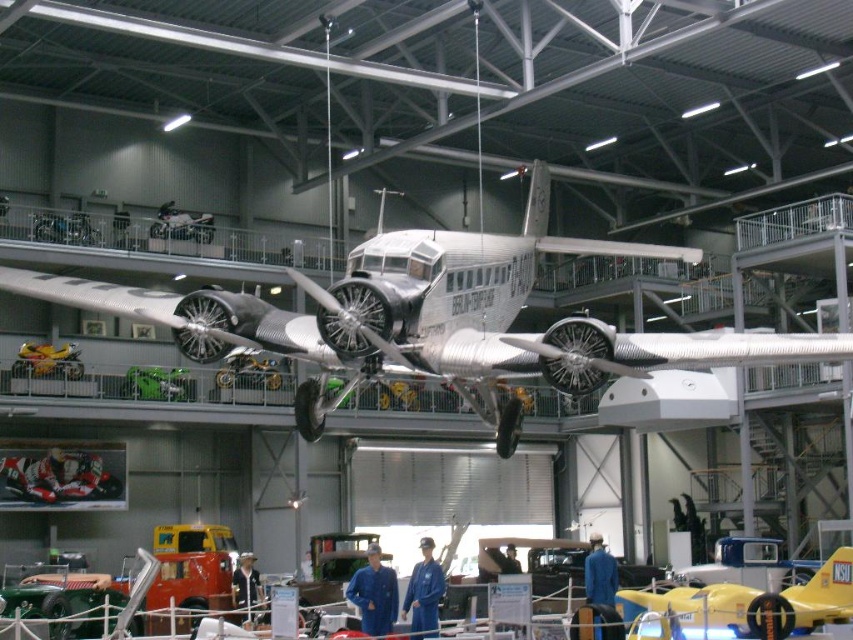
You are standing in the hangar and want to take a photo of the polished aluminum airplane at center. If your camera has a maximum focus range of 15 meters, will you need to move closer to get a clear shot?

The polished aluminum airplane at center is 16.43 meters away from viewer. Since the camera can only focus up to 15 meters, you need to move closer to ensure the airplane is within the focus range.

You are an engineer assessing the space requirements for moving the polished aluminum airplane at center and the yellow glossy airplane at center out of the hangar. Based on their widths, which airplane requires more careful maneuvering to avoid damaging the hangar walls?

The polished aluminum airplane at center might be wider than the yellow glossy airplane at center, so it requires more careful maneuvering to avoid damaging the hangar walls.